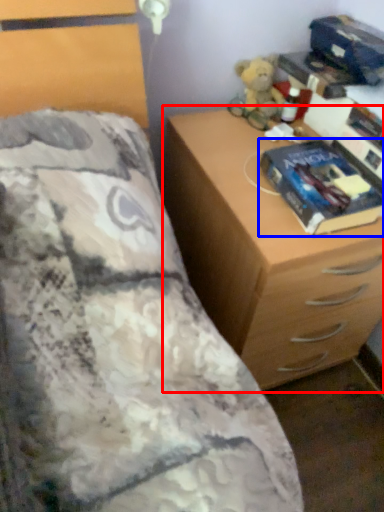
Question: Which object is closer to the camera taking this photo, chest of drawers (highlighted by a red box) or paperback book (highlighted by a blue box)?

Choices:
 (A) chest of drawers
 (B) paperback book

Answer: (A)